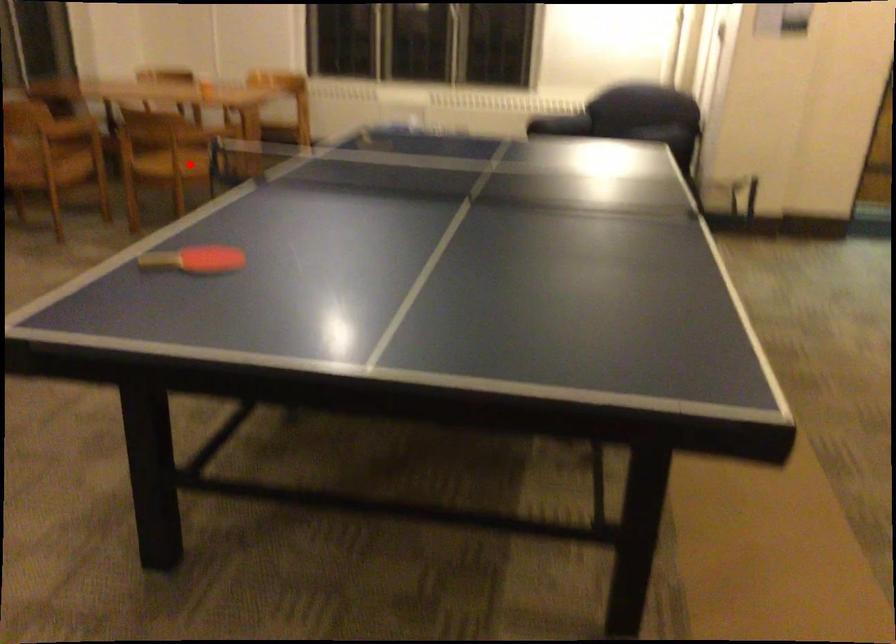
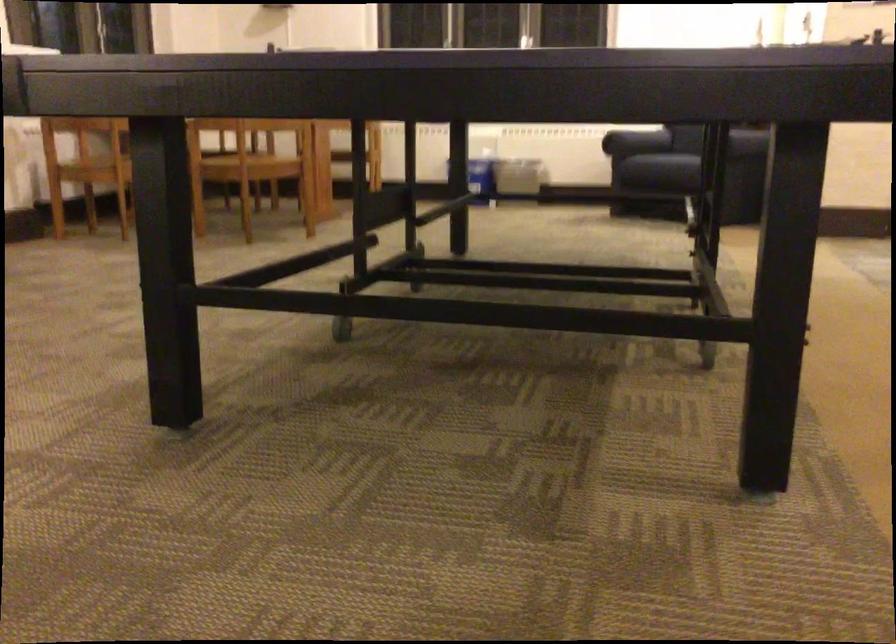
In the second image, find the point that corresponds to the highlighted location in the first image.

(248, 160)